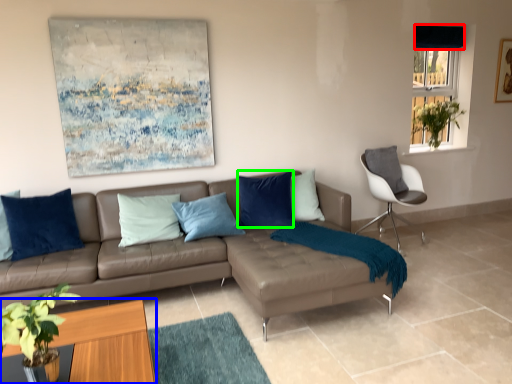
Question: Based on their relative distances, which object is farther from curtain (highlighted by a red box)? Choose from coffee table (highlighted by a blue box) and pillow (highlighted by a green box).

Choices:
 (A) coffee table
 (B) pillow

Answer: (A)